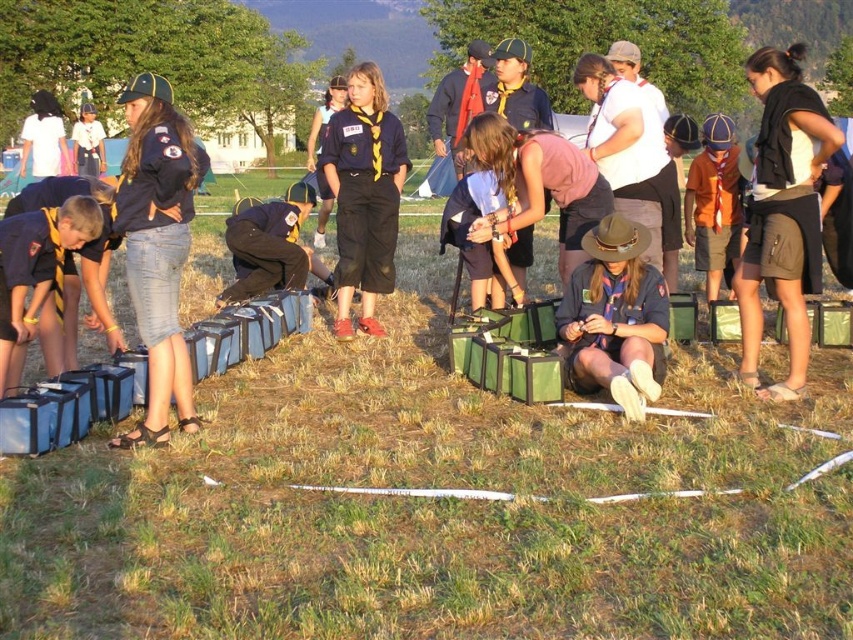
Question: Is green grass at center positioned in front of matte black uniform at center?

Choices:
 (A) no
 (B) yes

Answer: (B)

Question: Among these objects, which one is farthest from the camera?

Choices:
 (A) matte black uniform at center
 (B) green grass at center

Answer: (A)

Question: Is matte black uniform at center thinner than matte blue uniform at center?

Choices:
 (A) no
 (B) yes

Answer: (A)

Question: Which object is the closest to the matte blue uniform at center?

Choices:
 (A) green grass at center
 (B) matte black uniform at center

Answer: (B)

Question: Observing the image, what is the correct spatial positioning of green grass at center in reference to matte black uniform at center?

Choices:
 (A) right
 (B) left

Answer: (B)

Question: Which object appears farthest from the camera in this image?

Choices:
 (A) matte blue uniform at center
 (B) matte black uniform at center
 (C) green grass at center

Answer: (A)